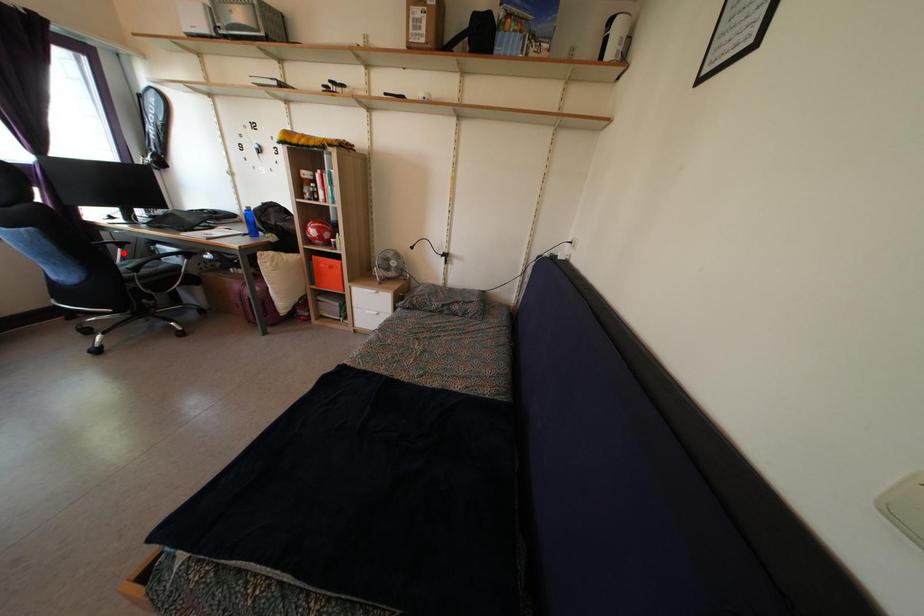
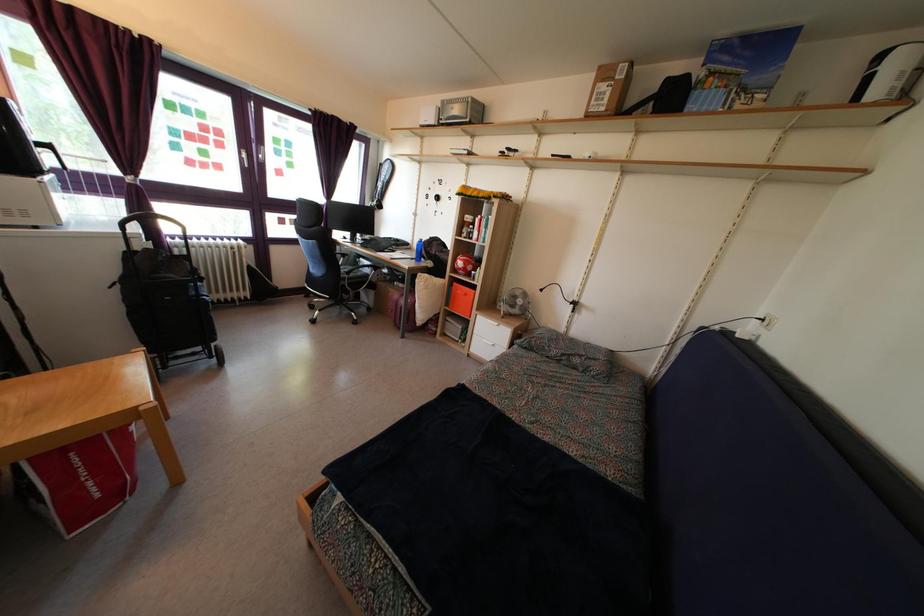
Question: I am providing you with two images of the same scene from different viewpoints. Image1 has a red point marked. In image2, the corresponding 3D location appears at what relative position? Reply with the corresponding letter.

Choices:
 (A) Closer
 (B) Farther

Answer: (A)